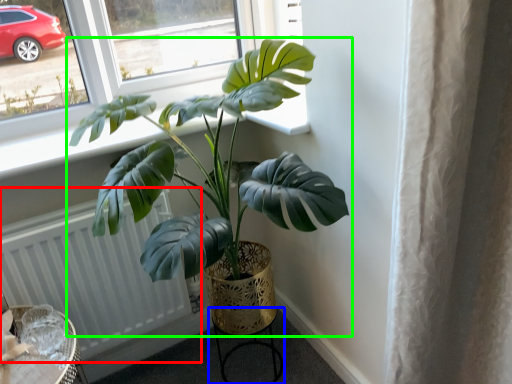
Question: Estimate the real-world distances between objects in this image. Which object is farther from radiator (highlighted by a red box), round table (highlighted by a blue box) or houseplant (highlighted by a green box)?

Choices:
 (A) round table
 (B) houseplant

Answer: (A)